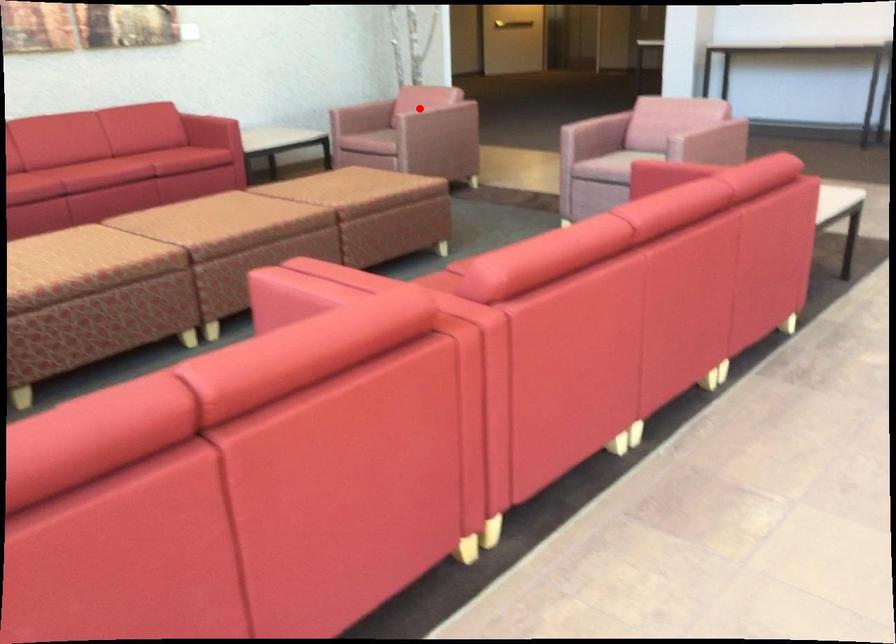
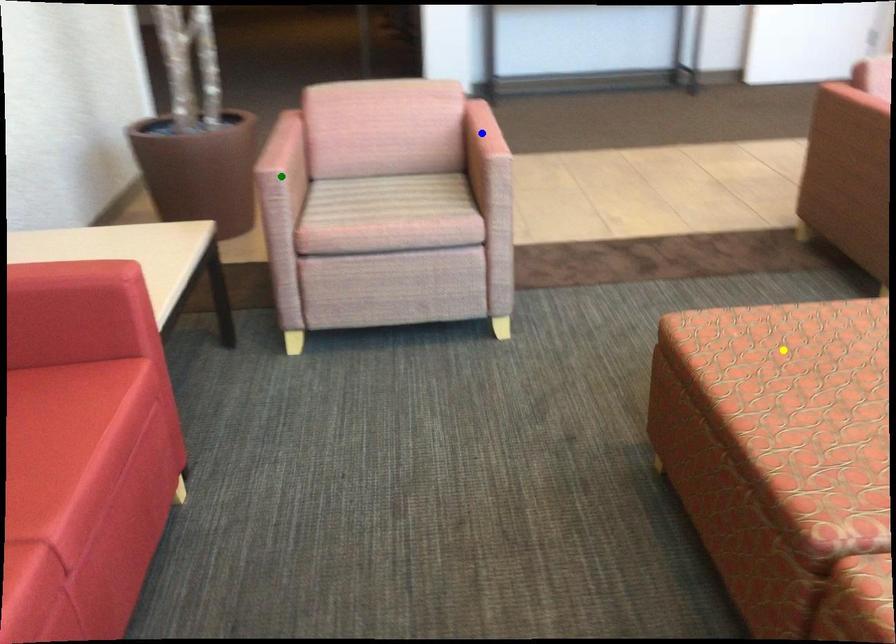
Question: I am providing you with two images of the same scene from different viewpoints. A red point is marked on the first image. You are given multiple points on the second image. In image 2, which mark is for the same physical point as the one in image 1?

Choices:
 (A) yellow point
 (B) blue point
 (C) green point

Answer: (B)